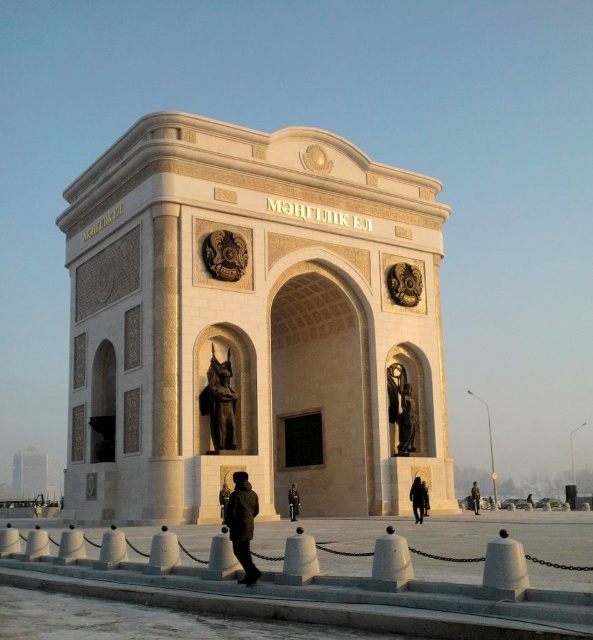
You are a photographer standing in front of the monument. You want to capture a photo that clearly shows both the dark brown leather jacket at center and the black matte person at center. Based on their positions, which object should be placed higher in the frame to ensure both are visible?

The dark brown leather jacket at center is above the black matte person at center, so to ensure both are visible, the jacket should be placed higher in the frame while positioning the person lower.

You are an architect analyzing the symmetry of the monument. You observe the satin gold statue at center and the black uniform at center. Which object is wider?

The satin gold statue at center is wider than the black uniform at center because the satin gold statue at center has a greater width as described.

You are a photographer standing in front of the monument and want to capture both the satin gold statue at center and the black uniform at center in a single shot. Which object should you focus on first to ensure both are in frame?

The satin gold statue at center is positioned over the black uniform at center, so focusing on the satin gold statue at center will ensure both are in frame as the statue is above the uniform.